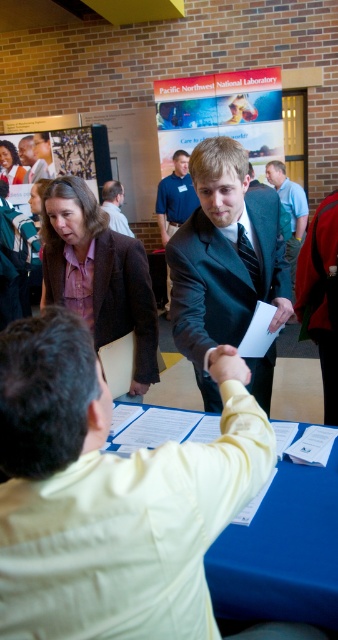
You are an event organizer at the Pacific Northwest National Laboratory networking event. You need to ensure that the two attendees wearing the matte purple shirt at center and the dark blue suit at center can comfortably sit next to each other at a round table with a diameter of 1.2 meters. Based on their clothing widths, will there be enough space for both of them to sit side by side?

The matte purple shirt at center is wider than the dark blue suit at center. Since the combined width of both individuals would exceed the diameter of the 1.2 meter table, they may not have enough space to sit comfortably side by side.

You are a photographer at the event and need to capture a photo that includes both the shiny black suit at center and the matte plastic poster at upper left. The camera you are using has a maximum focus range of 3.5 meters. Will you be able to include both objects in the same frame without moving the camera?

The shiny black suit at center and the matte plastic poster at upper left are 3.81 meters apart from each other. Since the camera can only focus up to 3.5 meters, you won cannot include both in the same frame without moving the camera.